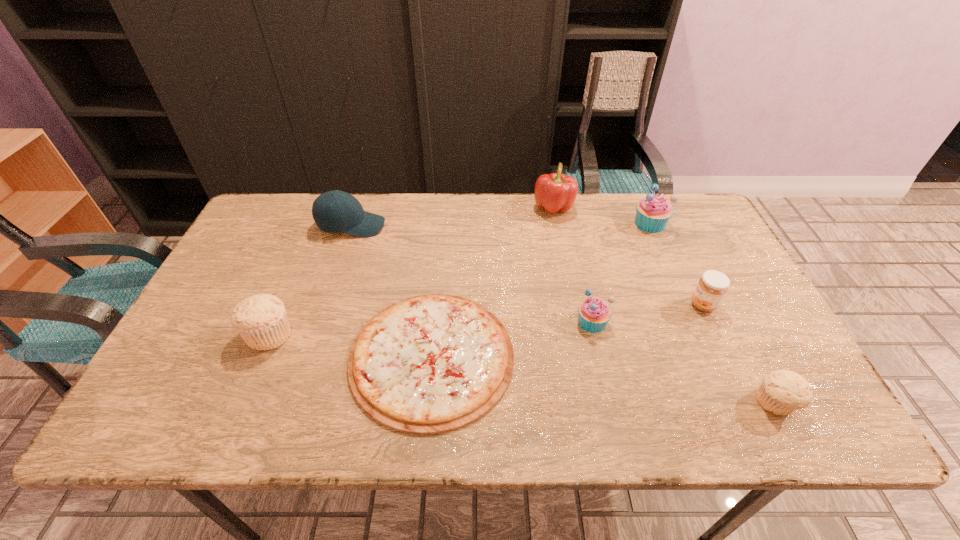
Locate an element on the screen. the smaller beige muffin is located at coordinates pos(781,392).

The height and width of the screenshot is (540, 960). Find the location of `the shortest object`. the shortest object is located at coordinates (429, 364).

Identify the location of free space located 0.190m on the left of the pepper. Image resolution: width=960 pixels, height=540 pixels. (475, 207).

At what (x,y) coordinates should I click in order to perform the action: click on vacant space located on the front-facing side of the baseball cap. Please return your answer as a coordinate pair (x, y). Image resolution: width=960 pixels, height=540 pixels. Looking at the image, I should click on (500, 226).

Where is `vacant space located on the front of the farthest muffin`? The image size is (960, 540). vacant space located on the front of the farthest muffin is located at coordinates (668, 266).

Find the location of `blank space located on the left of the bigger beige muffin`. blank space located on the left of the bigger beige muffin is located at coordinates (196, 334).

Locate an element on the screen. The height and width of the screenshot is (540, 960). free region located on the front label of the orange jam is located at coordinates (648, 305).

At what (x,y) coordinates should I click in order to perform the action: click on blank space located 0.250m on the front label of the orange jam. Please return your answer as a coordinate pair (x, y). The image size is (960, 540). Looking at the image, I should click on (594, 305).

Where is `blank space located 0.330m on the front label of the orange jam`? The image size is (960, 540). blank space located 0.330m on the front label of the orange jam is located at coordinates (564, 305).

This screenshot has height=540, width=960. Identify the location of blank area located on the back of the smaller blue muffin. (569, 225).